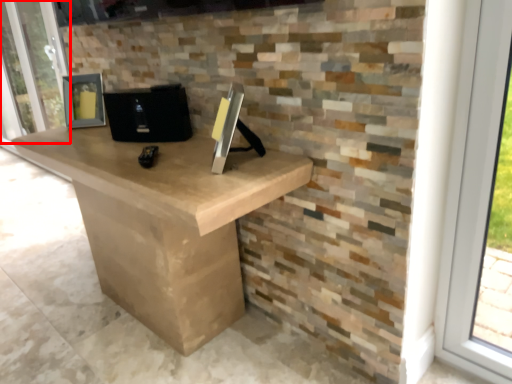
Question: From the image's perspective, where is screen door (annotated by the red box) located in relation to computer in the image?

Choices:
 (A) below
 (B) above

Answer: (B)